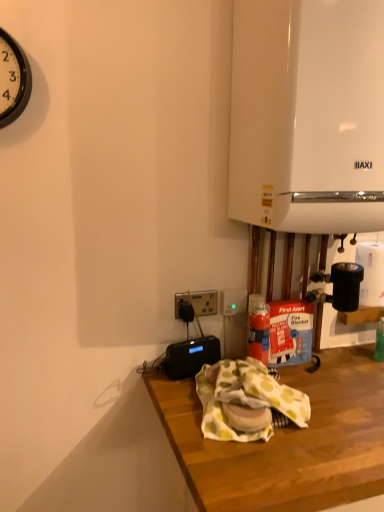
Question: From the image's perspective, is black plastic power outlet at center above white matte paper towel at right?

Choices:
 (A) no
 (B) yes

Answer: (A)

Question: Is black plastic power outlet at center outside white matte paper towel at right?

Choices:
 (A) no
 (B) yes

Answer: (B)

Question: Is black plastic power outlet at center turned away from white matte paper towel at right?

Choices:
 (A) no
 (B) yes

Answer: (A)

Question: From a real-world perspective, is black plastic power outlet at center located higher than white matte paper towel at right?

Choices:
 (A) no
 (B) yes

Answer: (A)

Question: Is black plastic power outlet at center facing towards white matte paper towel at right?

Choices:
 (A) yes
 (B) no

Answer: (B)

Question: From the image's perspective, is wooden desk at lower center located above or below black plastic power outlet at center?

Choices:
 (A) below
 (B) above

Answer: (A)

Question: From a real-world perspective, is wooden desk at lower center positioned above or below black plastic power outlet at center?

Choices:
 (A) below
 (B) above

Answer: (A)

Question: Considering the positions of wooden desk at lower center and black plastic power outlet at center in the image, is wooden desk at lower center bigger or smaller than black plastic power outlet at center?

Choices:
 (A) small
 (B) big

Answer: (B)

Question: From their relative heights in the image, would you say wooden desk at lower center is taller or shorter than black plastic power outlet at center?

Choices:
 (A) tall
 (B) short

Answer: (A)

Question: Is white glossy boiler at upper right, which appears as the 1th appliance when viewed from the right, inside or outside of white matte paper towel at right?

Choices:
 (A) inside
 (B) outside

Answer: (B)

Question: Is white glossy boiler at upper right, arranged as the first appliance when viewed from the top, bigger or smaller than white matte paper towel at right?

Choices:
 (A) small
 (B) big

Answer: (B)

Question: Based on their positions, is white glossy boiler at upper right, which appears as the 1th appliance when viewed from the right, located to the left or right of white matte paper towel at right?

Choices:
 (A) right
 (B) left

Answer: (B)

Question: From the image's perspective, is white glossy boiler at upper right, which is the 2th appliance from bottom to top, above or below white matte paper towel at right?

Choices:
 (A) below
 (B) above

Answer: (B)

Question: Does point (208, 350) appear closer or farther from the camera than point (324, 358)?

Choices:
 (A) closer
 (B) farther

Answer: (A)

Question: In terms of size, does black plastic radio at lower center, which is the 2th appliance in right-to-left order, appear bigger or smaller than wooden desk at lower center?

Choices:
 (A) small
 (B) big

Answer: (A)